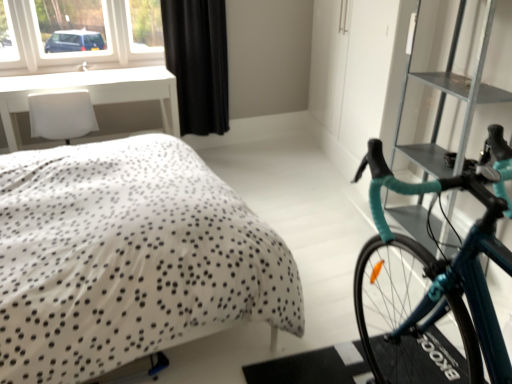
Question: From a real-world perspective, is white dotted fabric bed at center below teal glossy bicycle at right?

Choices:
 (A) no
 (B) yes

Answer: (B)

Question: Would you say white dotted fabric bed at center contains teal glossy bicycle at right?

Choices:
 (A) no
 (B) yes

Answer: (A)

Question: Is white dotted fabric bed at center not inside teal glossy bicycle at right?

Choices:
 (A) no
 (B) yes

Answer: (B)

Question: Considering the relative sizes of white dotted fabric bed at center and teal glossy bicycle at right in the image provided, is white dotted fabric bed at center shorter than teal glossy bicycle at right?

Choices:
 (A) yes
 (B) no

Answer: (A)

Question: Considering the relative positions of white dotted fabric bed at center and teal glossy bicycle at right in the image provided, is white dotted fabric bed at center to the right of teal glossy bicycle at right from the viewer's perspective?

Choices:
 (A) yes
 (B) no

Answer: (B)

Question: From the image's perspective, does white dotted fabric bed at center appear higher than teal glossy bicycle at right?

Choices:
 (A) yes
 (B) no

Answer: (A)

Question: Is black textured curtain at upper center not inside white glossy table at upper left?

Choices:
 (A) yes
 (B) no

Answer: (A)

Question: Can you confirm if black textured curtain at upper center is positioned to the right of white glossy table at upper left?

Choices:
 (A) yes
 (B) no

Answer: (A)

Question: Considering the relative sizes of black textured curtain at upper center and white glossy table at upper left in the image provided, is black textured curtain at upper center smaller than white glossy table at upper left?

Choices:
 (A) no
 (B) yes

Answer: (B)

Question: From the image's perspective, is black textured curtain at upper center on white glossy table at upper left?

Choices:
 (A) no
 (B) yes

Answer: (B)

Question: Considering the relative sizes of black textured curtain at upper center and white glossy table at upper left in the image provided, is black textured curtain at upper center shorter than white glossy table at upper left?

Choices:
 (A) no
 (B) yes

Answer: (A)

Question: Considering the relative sizes of black textured curtain at upper center and white glossy table at upper left in the image provided, is black textured curtain at upper center bigger than white glossy table at upper left?

Choices:
 (A) yes
 (B) no

Answer: (B)

Question: Is white glossy table at upper left turned away from white dotted fabric bed at center?

Choices:
 (A) no
 (B) yes

Answer: (A)